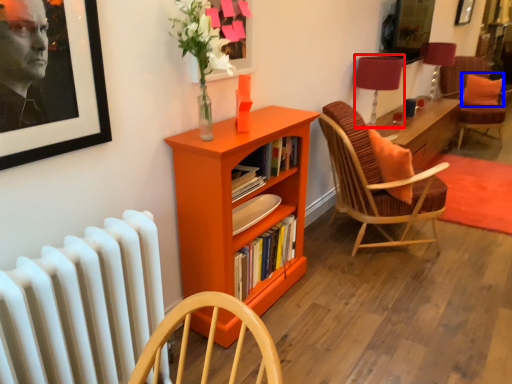
Question: Which point is further to the camera, table lamp (highlighted by a red box) or pillow (highlighted by a blue box)?

Choices:
 (A) table lamp
 (B) pillow

Answer: (B)